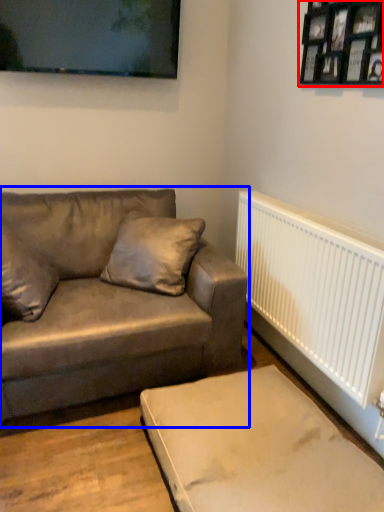
Question: Which point is closer to the camera, picture frame (highlighted by a red box) or studio couch (highlighted by a blue box)?

Choices:
 (A) picture frame
 (B) studio couch

Answer: (A)